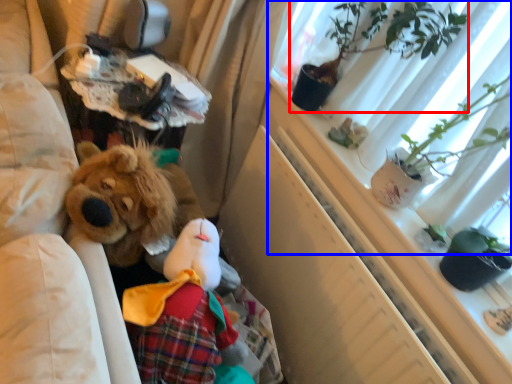
Question: Which object is closer to the camera taking this photo, houseplant (highlighted by a red box) or window screen (highlighted by a blue box)?

Choices:
 (A) houseplant
 (B) window screen

Answer: (B)